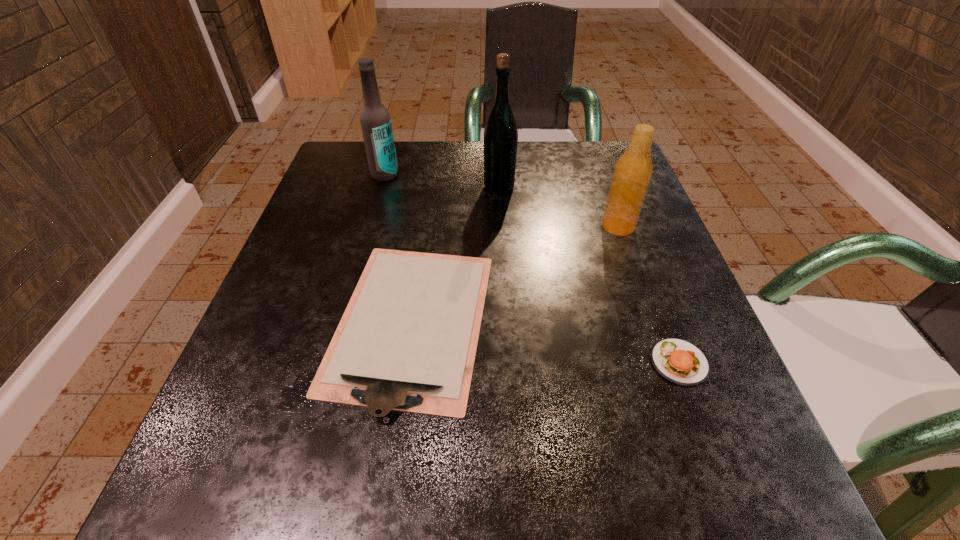
Image resolution: width=960 pixels, height=540 pixels. In order to click on vacant space in between the rightmost beer bottle and the patty in this screenshot , I will do (x=648, y=294).

Where is `vacant space that is in between the fourth tallest object and the shortest object`? The width and height of the screenshot is (960, 540). vacant space that is in between the fourth tallest object and the shortest object is located at coordinates (545, 342).

Select which object is the closest to the shortest object. Please provide its 2D coordinates. Your answer should be formatted as a tuple, i.e. [(x, y)], where the tuple contains the x and y coordinates of a point satisfying the conditions above.

[(500, 133)]

Identify which object is the second closest to the leftmost beer bottle. Please provide its 2D coordinates. Your answer should be formatted as a tuple, i.e. [(x, y)], where the tuple contains the x and y coordinates of a point satisfying the conditions above.

[(407, 341)]

Locate an element on the screen. beer bottle that is the closest one to the clipboard is located at coordinates (500, 133).

Locate an element on the screen. The image size is (960, 540). beer bottle that is the second nearest to the leftmost beer bottle is located at coordinates (632, 173).

You are a GUI agent. You are given a task and a screenshot of the screen. Output one action in this format:
    pyautogui.click(x=<x>, y=<y>)
    Task: Click on the vacant space that satisfies the following two spatial constraints: 1. on the side of the second beer bottle from right to left with the label; 2. on the right side of the leftmost beer bottle
    Image resolution: width=960 pixels, height=540 pixels.
    Given the screenshot: What is the action you would take?
    pyautogui.click(x=381, y=187)

The image size is (960, 540). In order to click on free space that satisfies the following two spatial constraints: 1. on the side of the shortest object with the label; 2. on the right side of the leftmost beer bottle in this screenshot , I will do `click(344, 322)`.

The width and height of the screenshot is (960, 540). Identify the location of vacant area that satisfies the following two spatial constraints: 1. on the side of the shortest object with the label; 2. on the left side of the leftmost beer bottle. (344, 322).

Identify the location of blank area in the image that satisfies the following two spatial constraints: 1. on the side of the leftmost beer bottle with the label; 2. on the left side of the second beer bottle from left to right. Image resolution: width=960 pixels, height=540 pixels. (381, 187).